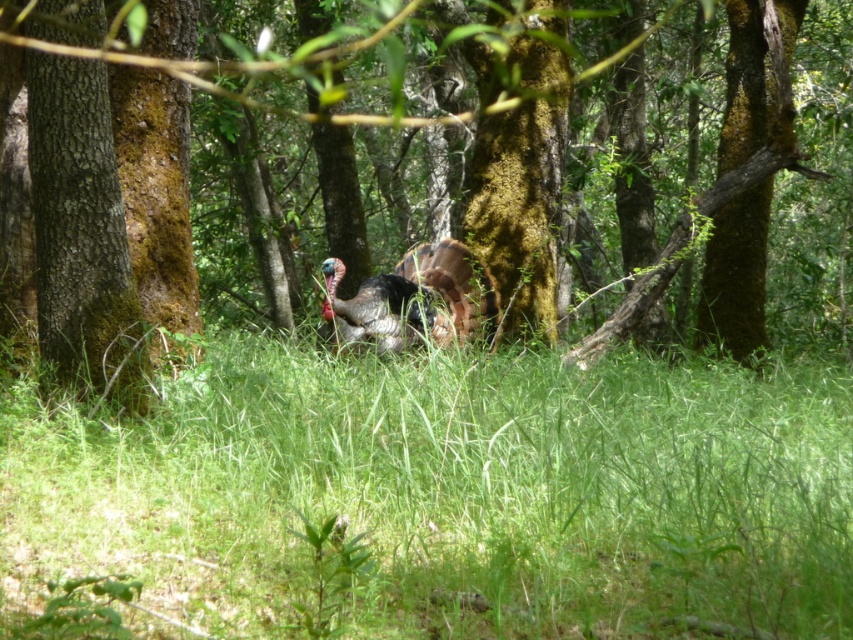
Question: Considering the relative positions of green grassy at center and shiny black turkey at center in the image provided, where is green grassy at center located with respect to shiny black turkey at center?

Choices:
 (A) right
 (B) left

Answer: (A)

Question: Which point is farther to the camera?

Choices:
 (A) (103, 472)
 (B) (88, 61)

Answer: (B)

Question: Is the position of green grassy at center less distant than that of shiny black turkey at center?

Choices:
 (A) no
 (B) yes

Answer: (B)

Question: Which of the following is the farthest from the observer?

Choices:
 (A) (781, 307)
 (B) (270, 468)
 (C) (433, 289)

Answer: (A)

Question: Among these objects, which one is farthest from the camera?

Choices:
 (A) shiny black turkey at center
 (B) brown mossy tree at center

Answer: (A)

Question: Considering the relative positions of shiny black turkey at center and brown mossy tree at center in the image provided, where is shiny black turkey at center located with respect to brown mossy tree at center?

Choices:
 (A) below
 (B) above

Answer: (A)